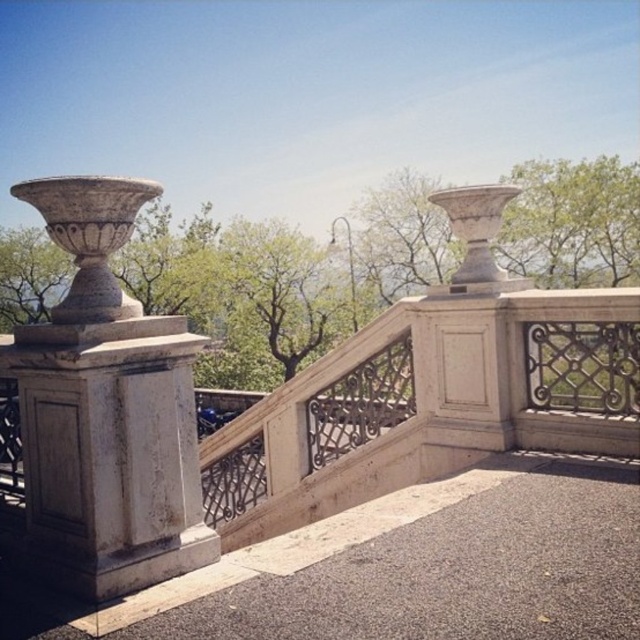
Question: Which object appears farthest from the camera in this image?

Choices:
 (A) green leafy tree at upper left
 (B) white marble vase at left

Answer: (A)

Question: Is white marble vase at left thinner than green leafy tree at upper left?

Choices:
 (A) no
 (B) yes

Answer: (B)

Question: Is white marble vase at left closer to the viewer compared to green leafy tree at upper left?

Choices:
 (A) yes
 (B) no

Answer: (A)

Question: Does white marble vase at left appear over green leafy tree at upper left?

Choices:
 (A) yes
 (B) no

Answer: (B)

Question: Among these objects, which one is nearest to the camera?

Choices:
 (A) green leafy tree at upper left
 (B) white marble vase at left

Answer: (B)